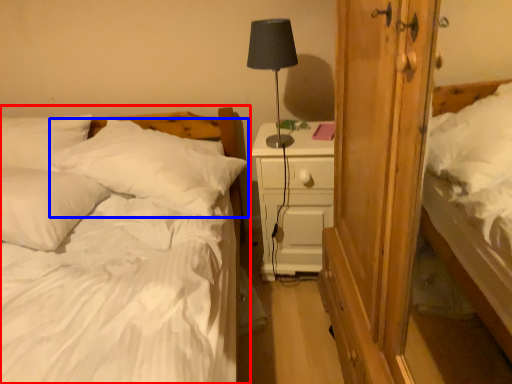
Question: Which of the following is the closest to the observer, bed (highlighted by a red box) or pillow (highlighted by a blue box)?

Choices:
 (A) bed
 (B) pillow

Answer: (A)